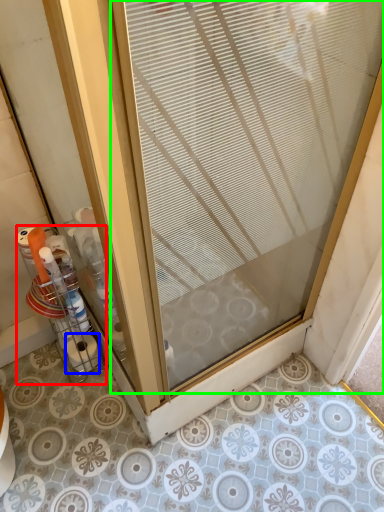
Question: Based on their relative distances, which object is farther from glass box (highlighted by a red box)? Choose from toilet paper (highlighted by a blue box) and door (highlighted by a green box).

Choices:
 (A) toilet paper
 (B) door

Answer: (B)